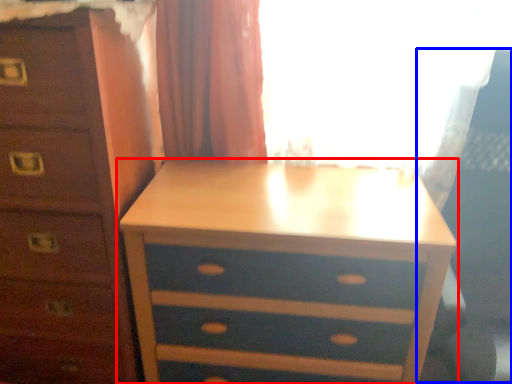
Question: Which object appears farthest to the camera in this image, nightstand (highlighted by a red box) or swivel chair (highlighted by a blue box)?

Choices:
 (A) nightstand
 (B) swivel chair

Answer: (A)